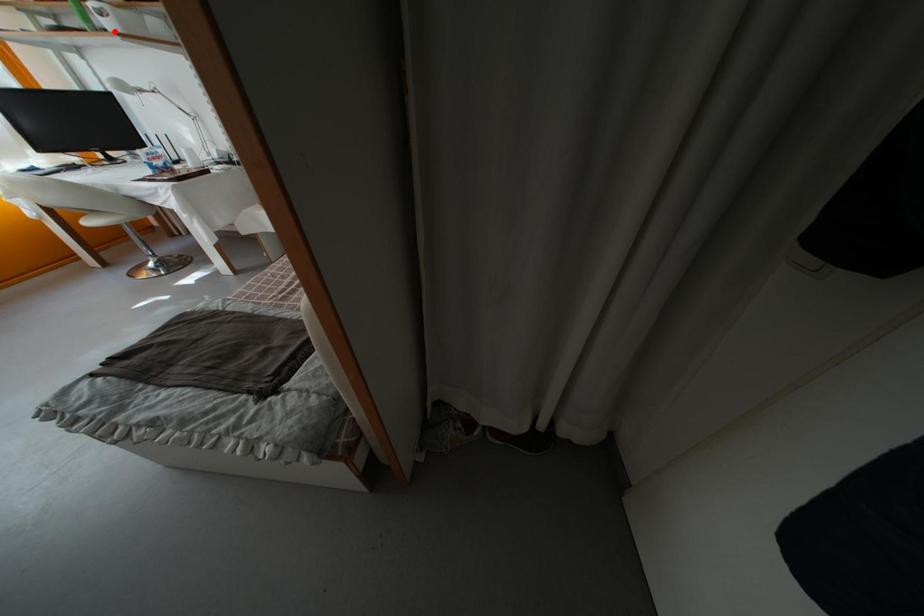
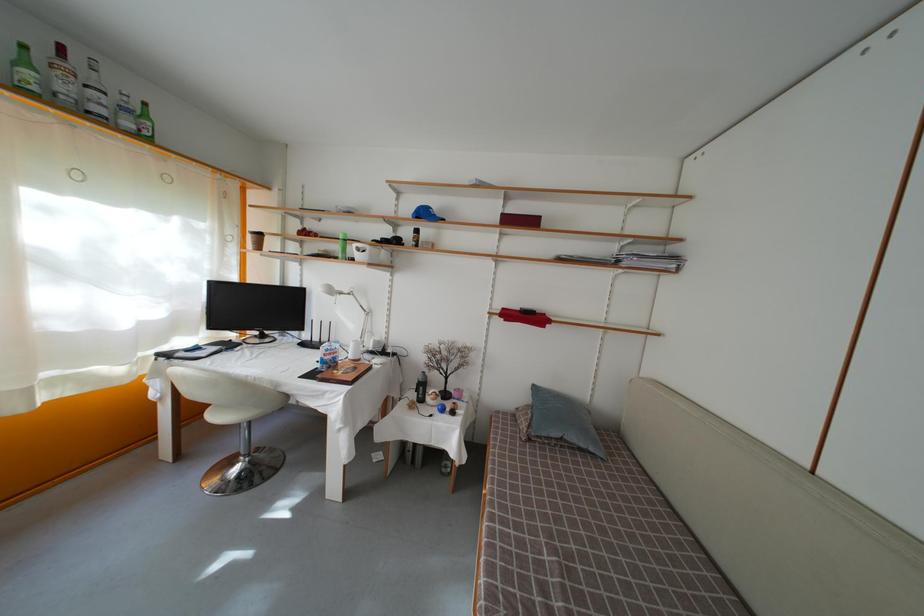
Question: I am providing you with two images of the same scene from different viewpoints. In image1, a red point is highlighted. Considering the same 3D point in image2, which of the following is correct?

Choices:
 (A) It is closer
 (B) It is farther

Answer: (A)